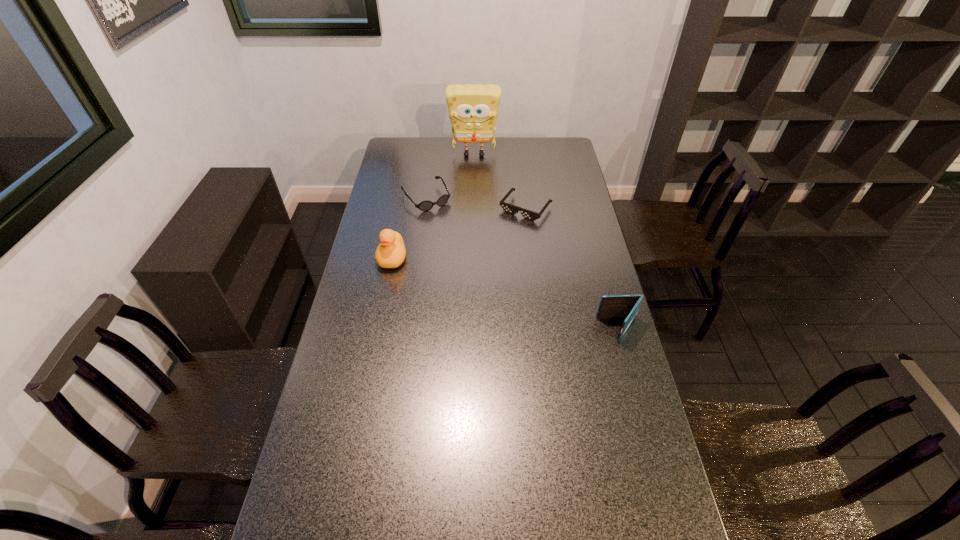
Identify the location of free space on the desktop that is between the second nearest object and the wallet and is positioned on the lenses of the left sunglasses. This screenshot has width=960, height=540. (500, 292).

Image resolution: width=960 pixels, height=540 pixels. What are the coordinates of `vacant spot on the desktop that is between the fourth farthest object and the rightmost object and is positioned on the face of the sponge` in the screenshot? It's located at (469, 282).

Find the location of a particular element. This screenshot has width=960, height=540. vacant space on the desktop that is between the second tallest object and the nearest object and is positioned on the front-facing side of the right sunglasses is located at coordinates (468, 282).